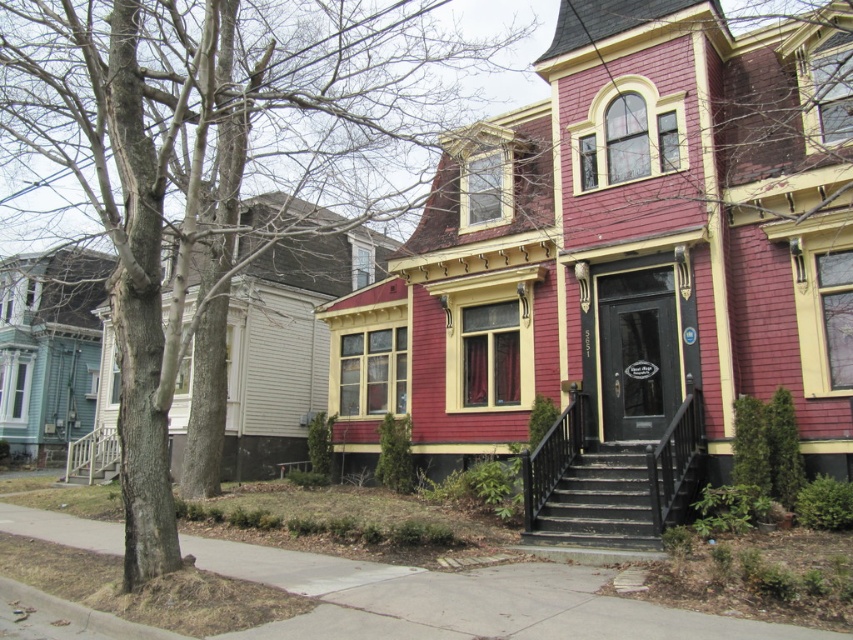
Question: Which of the following is the farthest from the observer?

Choices:
 (A) (471, 584)
 (B) (624, 492)
 (C) (10, 96)

Answer: (C)

Question: Which point is closer to the camera taking this photo?

Choices:
 (A) (334, 560)
 (B) (595, 500)
 (C) (138, 468)

Answer: (C)

Question: Which point is closer to the camera?

Choices:
 (A) concrete sidewalk at lower center
 (B) brown bark tree at left

Answer: (A)

Question: Is brown bark tree at left smaller than concrete sidewalk at lower center?

Choices:
 (A) no
 (B) yes

Answer: (A)

Question: Can you confirm if brown bark tree at left is bigger than black wooden stairs at center?

Choices:
 (A) no
 (B) yes

Answer: (B)

Question: Does concrete sidewalk at lower center have a smaller size compared to black wooden stairs at center?

Choices:
 (A) no
 (B) yes

Answer: (A)